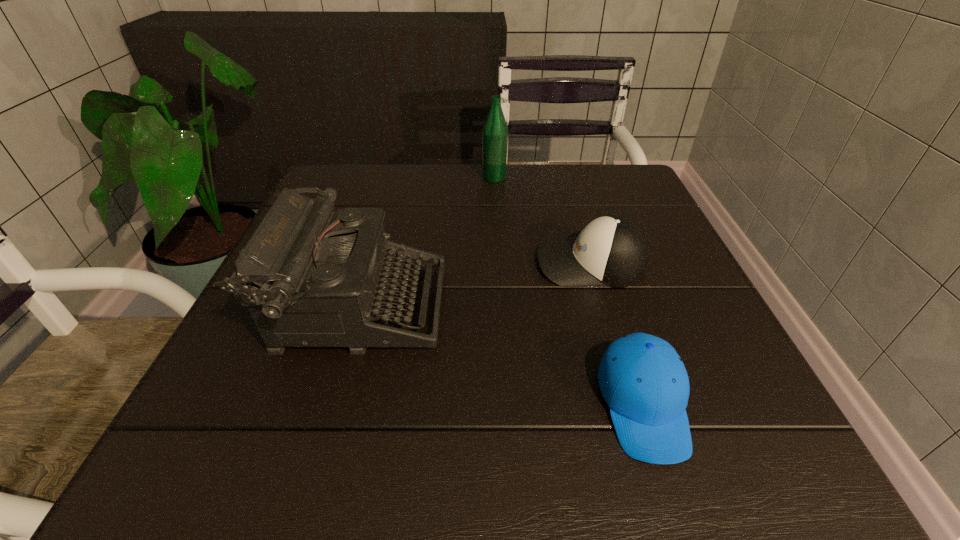
Where is `the third object from right to left`? Image resolution: width=960 pixels, height=540 pixels. the third object from right to left is located at coordinates (495, 131).

In order to click on the farthest object in this screenshot , I will do `click(495, 131)`.

I want to click on the leftmost object, so click(317, 277).

Locate an element on the screen. the taller cap is located at coordinates (612, 251).

Where is `the farther cap`? This screenshot has width=960, height=540. the farther cap is located at coordinates (612, 251).

Where is `the shortest object`? the shortest object is located at coordinates (643, 380).

Where is `the nearer cap`? The height and width of the screenshot is (540, 960). the nearer cap is located at coordinates (643, 380).

You are a GUI agent. You are given a task and a screenshot of the screen. Output one action in this format:
    pyautogui.click(x=<x>, y=<y>)
    Task: Click on the vacant area located 0.170m on the right of the second object from left to right
    The height and width of the screenshot is (540, 960).
    Given the screenshot: What is the action you would take?
    pyautogui.click(x=572, y=178)

I want to click on free space located on the typing side of the leftmost object, so click(492, 307).

Locate an element on the screen. The width and height of the screenshot is (960, 540). free space located on the front panel of the farther cap is located at coordinates (396, 264).